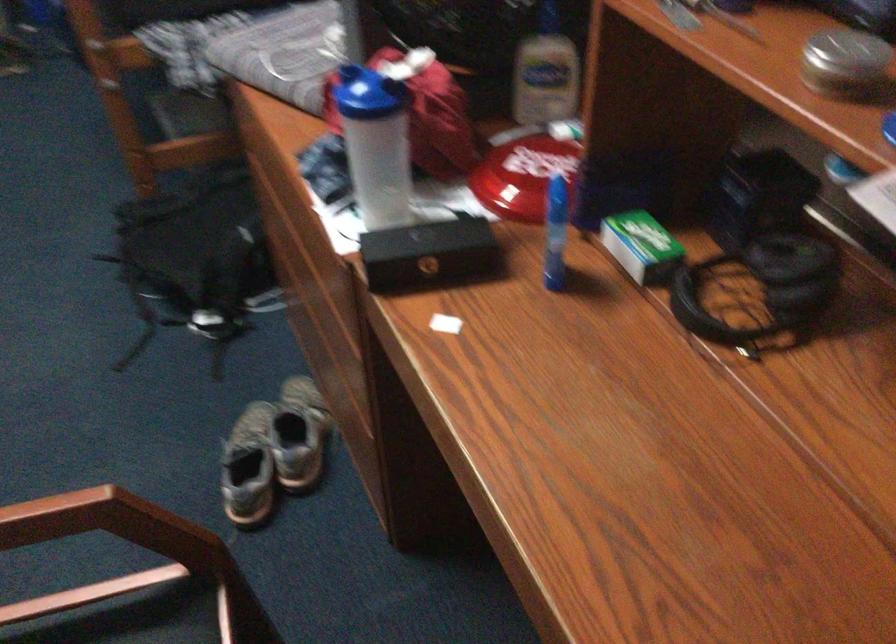
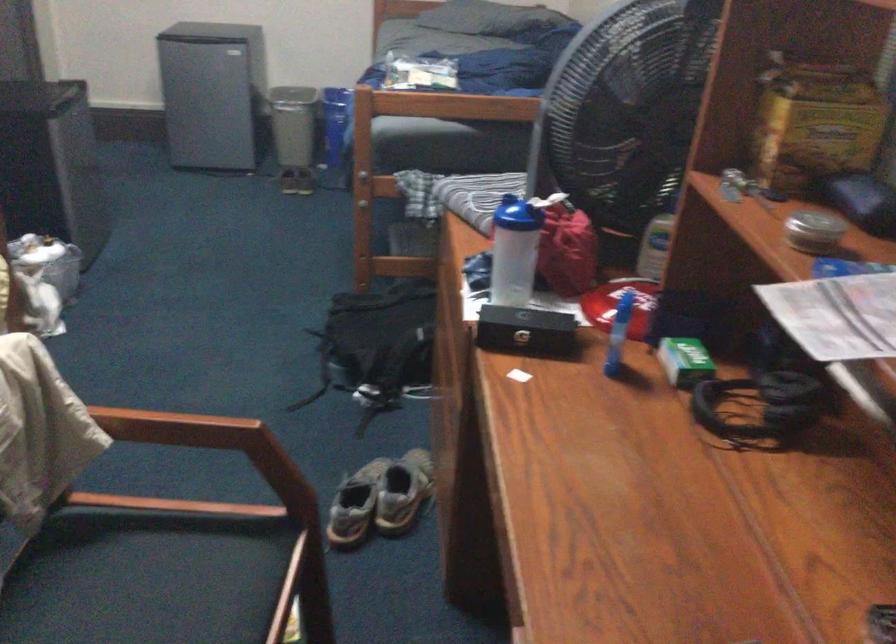
Question: The first image is from the beginning of the video and the second image is from the end. How did the camera likely rotate when shooting the video?

Choices:
 (A) Left
 (B) Right
 (C) Up
 (D) Down

Answer: (A)